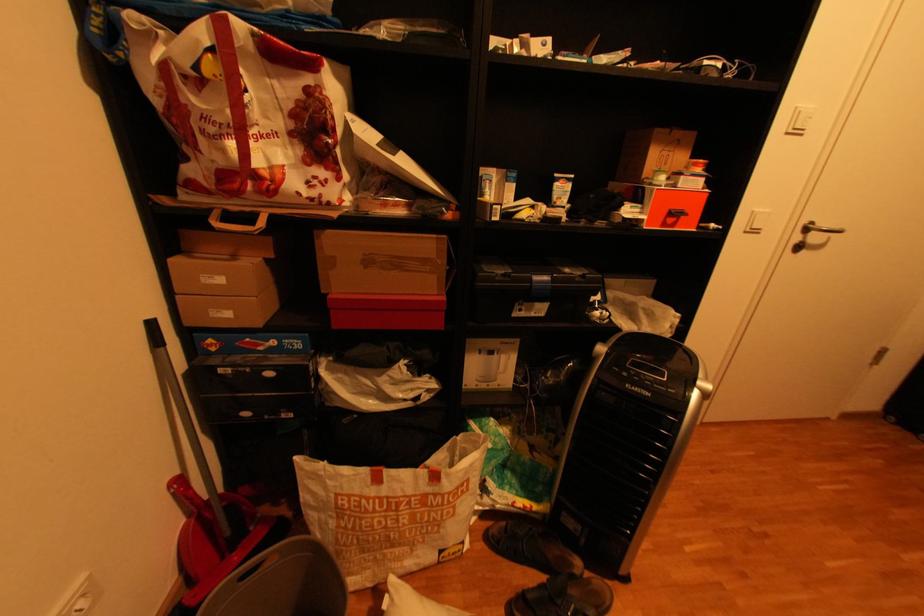
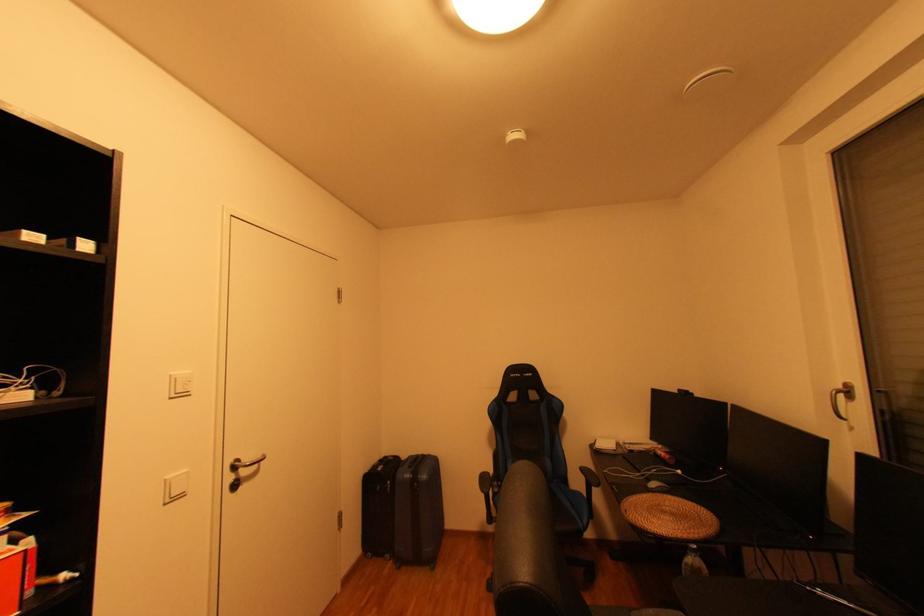
Find the pixel in the second image that matches (x=821, y=223) in the first image.

(247, 461)